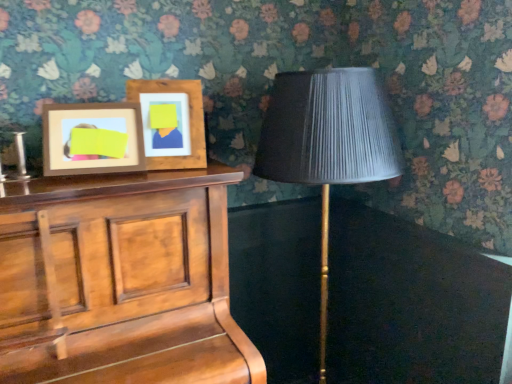
The height and width of the screenshot is (384, 512). What are the coordinates of `vacant area on top of wooden picture frame at upper left, acting as the 2th picture frame starting from the right (from a real-world perspective)` in the screenshot? It's located at (97, 105).